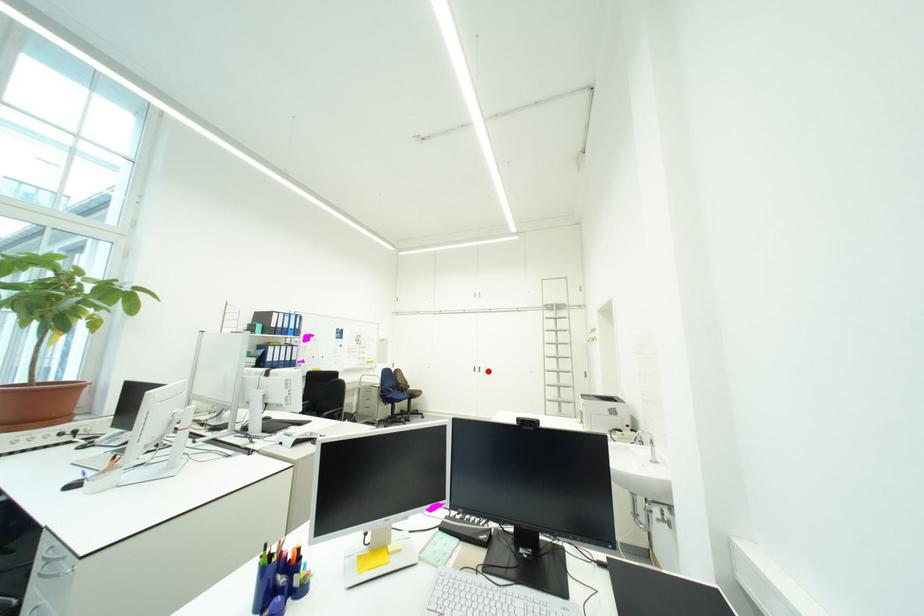
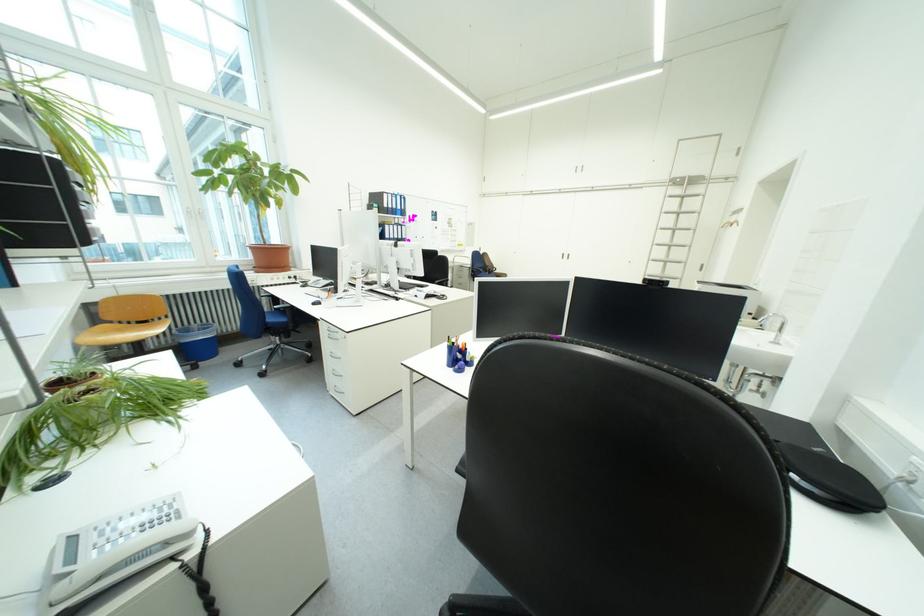
Where in the second image is the point corresponding to the highlighted location from the first image?

(577, 257)